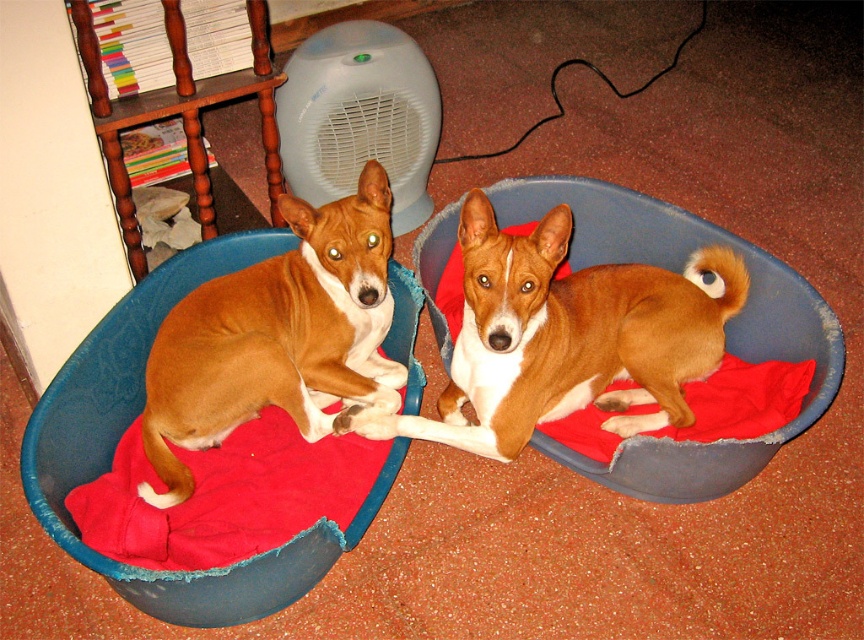
Question: Can you confirm if brown matte dog at left is positioned above velvet-like blue pet bed at left?

Choices:
 (A) yes
 (B) no

Answer: (A)

Question: Estimate the real-world distances between objects in this image. Which object is farther from the soft fleece dog bed at center?

Choices:
 (A) brown matte dog at left
 (B) velvet-like blue pet bed at left

Answer: (B)

Question: Which of the following is the closest to the observer?

Choices:
 (A) velvet-like blue pet bed at left
 (B) soft fleece dog bed at center
 (C) brown matte dog at left

Answer: (A)

Question: Which object appears farthest from the camera in this image?

Choices:
 (A) velvet-like blue pet bed at left
 (B) brown matte dog at left
 (C) soft fleece dog bed at center

Answer: (C)

Question: Is brown matte dog at left bigger than soft fleece dog bed at center?

Choices:
 (A) no
 (B) yes

Answer: (A)

Question: Does velvet-like blue pet bed at left appear on the right side of soft fleece dog bed at center?

Choices:
 (A) no
 (B) yes

Answer: (A)